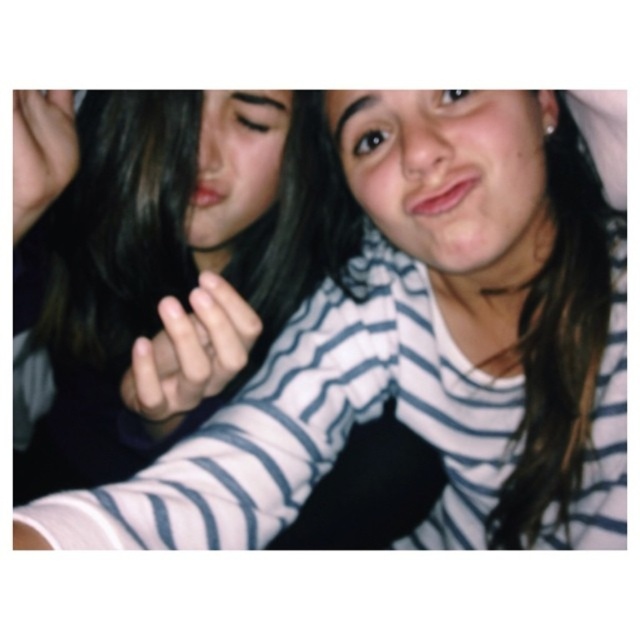
Can you confirm if smooth skin hand at center is positioned to the right of smooth skin hand at upper left?

Yes, smooth skin hand at center is to the right of smooth skin hand at upper left.

Who is more forward, (248, 342) or (72, 100)?

Point (248, 342) is more forward.

The image size is (640, 640). I want to click on smooth skin hand at center, so click(x=189, y=353).

I want to click on smooth skin hand at center, so click(x=189, y=353).

Between white striped shirt at center and smooth skin hand at upper left, which one appears on the left side from the viewer's perspective?

Positioned to the left is smooth skin hand at upper left.

Can you confirm if white striped shirt at center is positioned below smooth skin hand at upper left?

Yes.

What are the coordinates of `white striped shirt at center` in the screenshot? It's located at (374, 339).

Locate an element on the screen. white striped shirt at center is located at coordinates (374, 339).

Does white striped shirt at center appear on the right side of smooth skin hand at center?

Yes, white striped shirt at center is to the right of smooth skin hand at center.

Where is `white striped shirt at center`? white striped shirt at center is located at coordinates (374, 339).

Describe the element at coordinates (374, 339) in the screenshot. I see `white striped shirt at center` at that location.

Image resolution: width=640 pixels, height=640 pixels. Identify the location of white striped shirt at center. (374, 339).